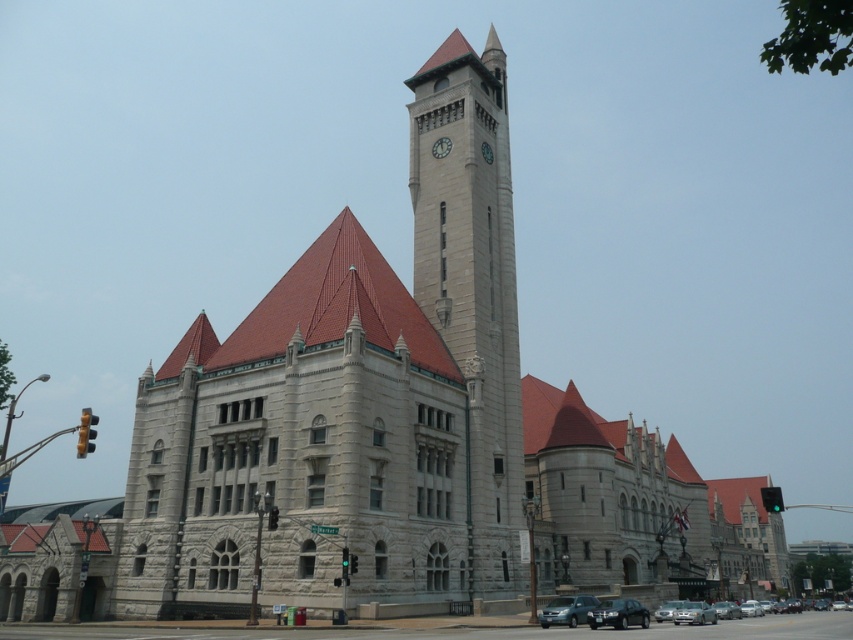
Is point (409, 164) closer to viewer compared to point (491, 154)?

No.

Between point (494, 522) and point (486, 154), which one is positioned behind?

The point (486, 154) is more distant.

Find the location of a particular element. This screenshot has height=640, width=853. stone clock tower at center is located at coordinates (473, 285).

Does metallic silver car at lower center have a larger size compared to metallic clock at center?

Indeed, metallic silver car at lower center has a larger size compared to metallic clock at center.

Is metallic silver car at lower center thinner than metallic clock at center?

No.

Is point (698, 620) farther from camera compared to point (437, 141)?

No, (698, 620) is in front of (437, 141).

I want to click on metallic silver car at lower center, so click(694, 612).

Who is shorter, shiny black suv at lower center or white stone clock at upper center?

Standing shorter between the two is white stone clock at upper center.

Which is behind, point (622, 625) or point (486, 148)?

Point (486, 148)

At what (x,y) coordinates should I click in order to perform the action: click on shiny black suv at lower center. Please return your answer as a coordinate pair (x, y). The image size is (853, 640). Looking at the image, I should click on (618, 612).